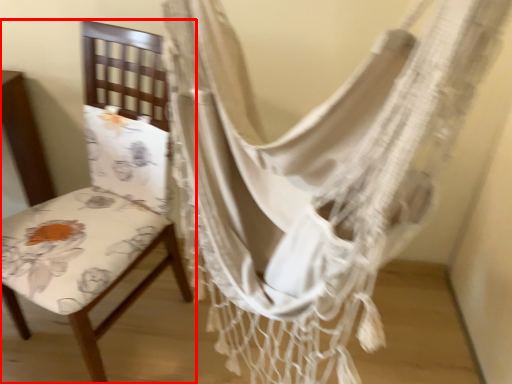
Question: Where is chair (annotated by the red box) located in relation to curtain in the image?

Choices:
 (A) left
 (B) right

Answer: (A)